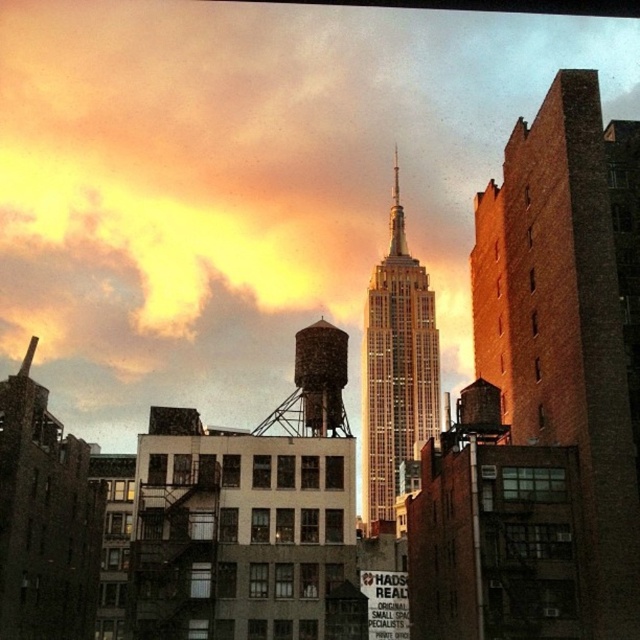
Between point (541, 337) and point (387, 508), which one is positioned in front?

Positioned in front is point (541, 337).

The image size is (640, 640). Describe the element at coordinates (570, 317) in the screenshot. I see `brick building at right` at that location.

Describe the element at coordinates (570, 317) in the screenshot. I see `brick building at right` at that location.

This screenshot has width=640, height=640. I want to click on brick building at right, so click(570, 317).

Identify the location of orange sky at upper center. The width and height of the screenshot is (640, 640). (248, 182).

Does orange sky at upper center have a smaller size compared to rustic metal water tower at center?

Incorrect, orange sky at upper center is not smaller in size than rustic metal water tower at center.

Which is behind, point (198, 320) or point (317, 336)?

Point (198, 320)

The width and height of the screenshot is (640, 640). I want to click on orange sky at upper center, so (248, 182).

Is gold glass skyscraper at center bigger than rustic metal water tower at center?

Yes, gold glass skyscraper at center is bigger than rustic metal water tower at center.

Based on the photo, is gold glass skyscraper at center to the right of rustic metal water tower at center from the viewer's perspective?

Indeed, gold glass skyscraper at center is positioned on the right side of rustic metal water tower at center.

What do you see at coordinates (396, 368) in the screenshot? I see `gold glass skyscraper at center` at bounding box center [396, 368].

The height and width of the screenshot is (640, 640). Identify the location of gold glass skyscraper at center. (396, 368).